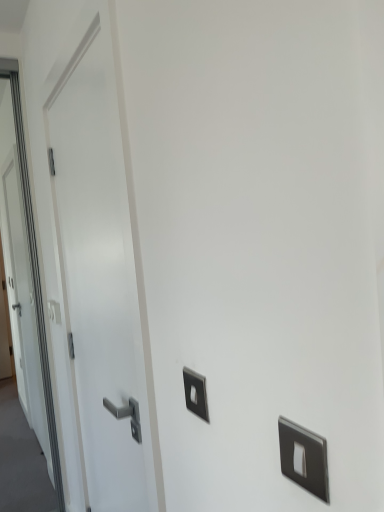
Question: In terms of height, does satin silver switch at left, which appears as the first light switch when viewed from the back, look taller or shorter compared to white glossy door at left?

Choices:
 (A) tall
 (B) short

Answer: (B)

Question: From a real-world perspective, is satin silver switch at left, which appears as the first light switch when viewed from the back, above or below white glossy door at left?

Choices:
 (A) below
 (B) above

Answer: (A)

Question: Which object is positioned farthest from the white glossy door at left?

Choices:
 (A) satin silver switch at left, acting as the first light switch starting from the left
 (B) satin silver switch at center, marked as the first light switch in a front-to-back arrangement

Answer: (A)

Question: Based on their relative distances, which object is nearer to the white glossy door at left?

Choices:
 (A) satin silver switch at center, the 2th light switch in the back-to-front sequence
 (B) satin silver switch at left, which appears as the first light switch when viewed from the back

Answer: (A)